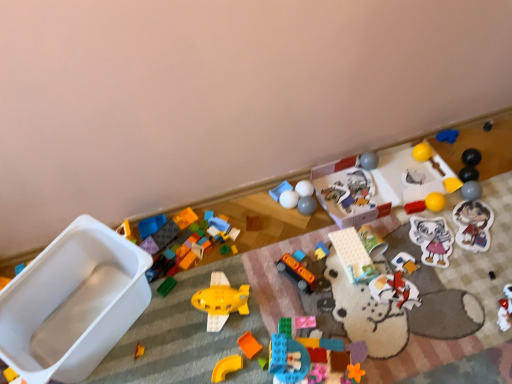
In order to click on free space between rubber duck at center, which ranks as the eleventh toy in right-to-left order, and orange matte block at center, acting as the sixth toy starting from the left in this screenshot , I will do `click(283, 306)`.